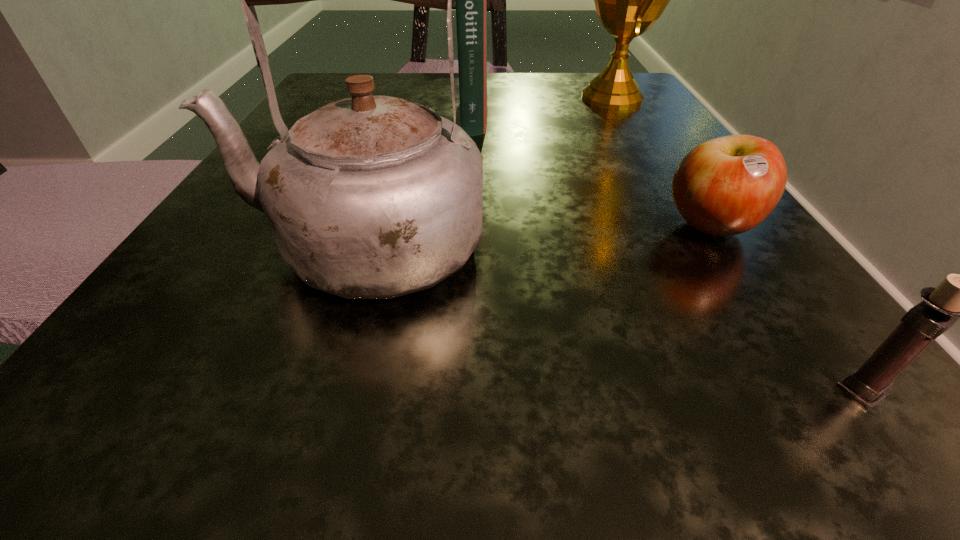
Locate an element on the screen. vacant point that satisfies the following two spatial constraints: 1. on the cover of the hardback book; 2. on the back side of the apple is located at coordinates (470, 227).

What are the coordinates of `vacant area that satisfies the following two spatial constraints: 1. on the cover of the candle holder; 2. on the left side of the hardback book` in the screenshot? It's located at (466, 390).